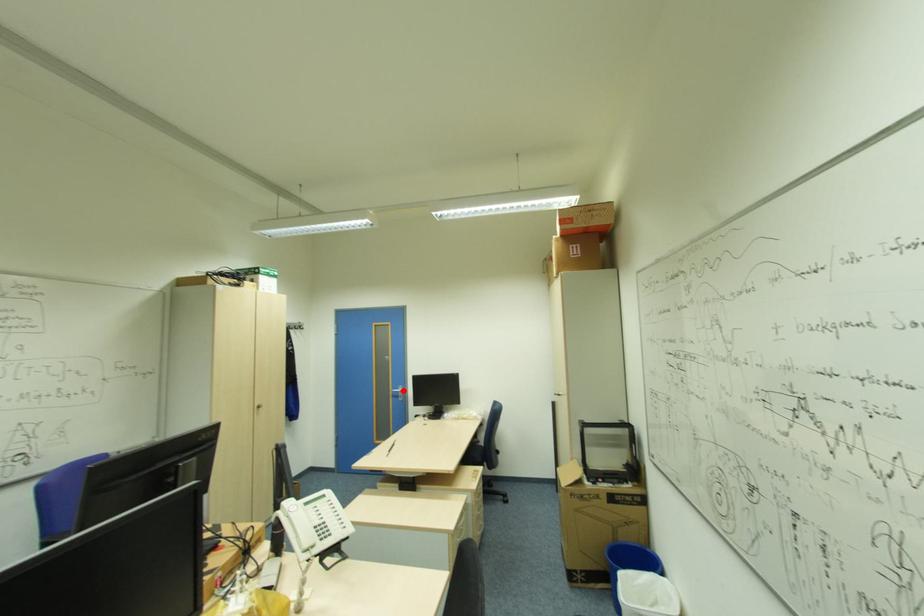
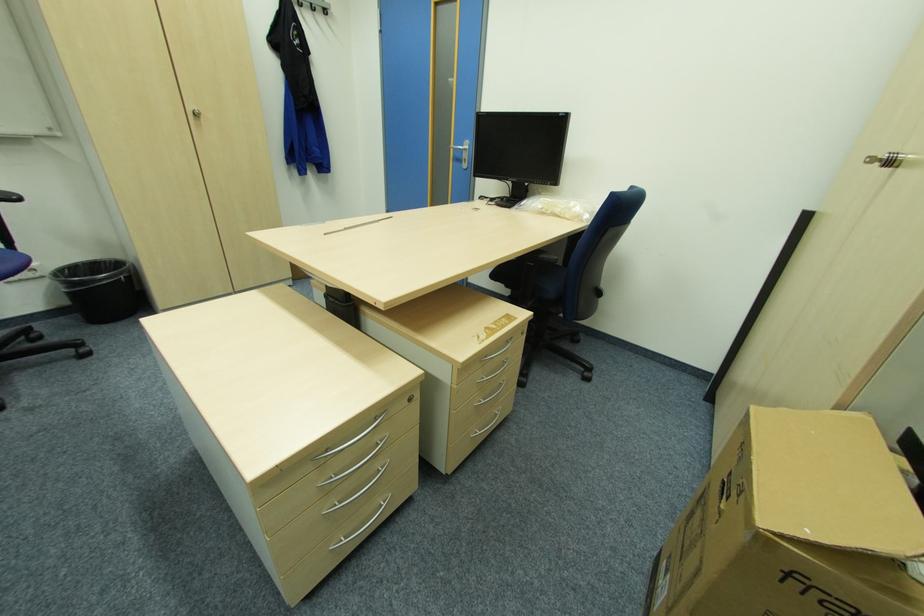
Locate, in the second image, the point that corresponds to the highlighted location in the first image.

(468, 148)